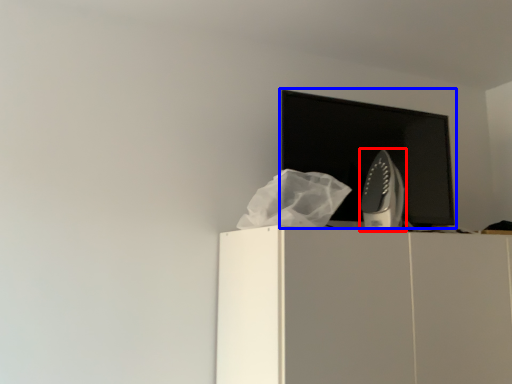
Question: Which point is further to the camera, home appliance (highlighted by a red box) or computer monitor (highlighted by a blue box)?

Choices:
 (A) home appliance
 (B) computer monitor

Answer: (B)